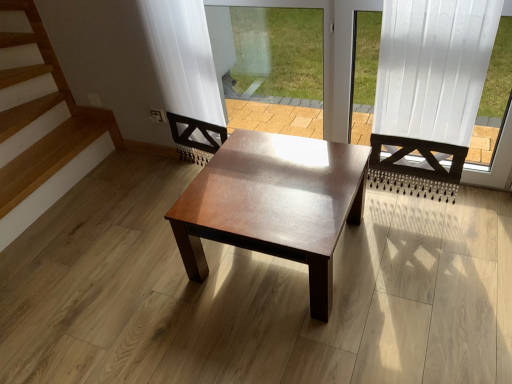
What do you see at coordinates (277, 55) in the screenshot?
I see `transparent glass window screen at center` at bounding box center [277, 55].

Looking at this image, measure the distance between shiny brown wood coffee table at center and camera.

shiny brown wood coffee table at center and camera are 4.67 feet apart.

You are a GUI agent. You are given a task and a screenshot of the screen. Output one action in this format:
    pyautogui.click(x=<x>, y=<y>)
    Task: Click on the white wood frame at upper right
    The height and width of the screenshot is (384, 512).
    Given the screenshot: What is the action you would take?
    (x=327, y=53)

Locate an element on the screen. The image size is (512, 384). window frame in front of the shiny brown wood coffee table at center is located at coordinates (327, 53).

Between shiny brown wood coffee table at center and white wood frame at upper right, which one appears on the right side from the viewer's perspective?

Positioned to the right is white wood frame at upper right.

Is shiny brown wood coffee table at center positioned in front of white wood frame at upper right?

No, it is behind white wood frame at upper right.

From the image's perspective, is transparent glass window screen at center on top of shiny brown wood coffee table at center?

Yes, from the image's perspective, transparent glass window screen at center is over shiny brown wood coffee table at center.

Based on the photo, which object is closer to the camera taking this photo, transparent glass window screen at center or shiny brown wood coffee table at center?

shiny brown wood coffee table at center.

Would you say transparent glass window screen at center is a long distance from shiny brown wood coffee table at center?

Yes, transparent glass window screen at center and shiny brown wood coffee table at center are located far from each other.

Does transparent glass window screen at center have a smaller size compared to shiny brown wood coffee table at center?

Yes, transparent glass window screen at center is smaller than shiny brown wood coffee table at center.

Is white wood frame at upper right surrounded by transparent glass window screen at center?

No, transparent glass window screen at center does not contain white wood frame at upper right.

From a real-world perspective, is transparent glass window screen at center positioned above or below white wood frame at upper right?

In terms of real-world spatial position, transparent glass window screen at center is below white wood frame at upper right.

Does transparent glass window screen at center turn towards white wood frame at upper right?

No.

Locate an element on the screen. window frame on the right of transparent glass window screen at center is located at coordinates (327, 53).

What's the angular difference between white wood frame at upper right and shiny brown wood coffee table at center's facing directions?

0.546 degrees.

Is white wood frame at upper right wider or thinner than shiny brown wood coffee table at center?

Considering their sizes, white wood frame at upper right looks slimmer than shiny brown wood coffee table at center.

From the image's perspective, between white wood frame at upper right and shiny brown wood coffee table at center, which one is located above?

white wood frame at upper right appears higher in the image.

Is white wood frame at upper right turned away from shiny brown wood coffee table at center?

white wood frame at upper right is not turned away from shiny brown wood coffee table at center.

Can you confirm if shiny brown wood coffee table at center is shorter than transparent glass window screen at center?

Yes, shiny brown wood coffee table at center is shorter than transparent glass window screen at center.

Is shiny brown wood coffee table at center oriented away from transparent glass window screen at center?

Yes, shiny brown wood coffee table at center's orientation is away from transparent glass window screen at center.

Locate an element on the screen. window screen located above the shiny brown wood coffee table at center (from the image's perspective) is located at coordinates (277, 55).

Is white wood frame at upper right not within transparent glass window screen at center?

white wood frame at upper right is positioned outside transparent glass window screen at center.

Considering the sizes of objects white wood frame at upper right and transparent glass window screen at center in the image provided, who is taller, white wood frame at upper right or transparent glass window screen at center?

Standing taller between the two is white wood frame at upper right.

Are white wood frame at upper right and transparent glass window screen at center located far from each other?

white wood frame at upper right is near transparent glass window screen at center, not far away.

In the scene shown: From the image's perspective, would you say white wood frame at upper right is positioned over transparent glass window screen at center?

No, from the image's perspective, white wood frame at upper right is not on top of transparent glass window screen at center.

This screenshot has height=384, width=512. I want to click on window frame in front of the shiny brown wood coffee table at center, so click(x=327, y=53).

I want to click on coffee table on the right of transparent glass window screen at center, so click(x=274, y=204).

When comparing their distances from white wood frame at upper right, does transparent glass window screen at center or shiny brown wood coffee table at center seem further?

The object further to white wood frame at upper right is shiny brown wood coffee table at center.

Based on their spatial positions, is white wood frame at upper right or transparent glass window screen at center closer to shiny brown wood coffee table at center?

white wood frame at upper right is positioned closer to the anchor shiny brown wood coffee table at center.

From the image, which object appears to be nearer to transparent glass window screen at center, shiny brown wood coffee table at center or white wood frame at upper right?

white wood frame at upper right lies closer to transparent glass window screen at center than the other object.

Based on their spatial positions, is transparent glass window screen at center or white wood frame at upper right further from shiny brown wood coffee table at center?

Among the two, transparent glass window screen at center is located further to shiny brown wood coffee table at center.

Consider the image. Based on their spatial positions, is shiny brown wood coffee table at center or transparent glass window screen at center closer to white wood frame at upper right?

transparent glass window screen at center is closer to white wood frame at upper right.

Estimate the real-world distances between objects in this image. Which object is further from transparent glass window screen at center, white wood frame at upper right or shiny brown wood coffee table at center?

shiny brown wood coffee table at center.

Where is `coffee table between transparent glass window screen at center and white wood frame at upper right`? coffee table between transparent glass window screen at center and white wood frame at upper right is located at coordinates (274, 204).